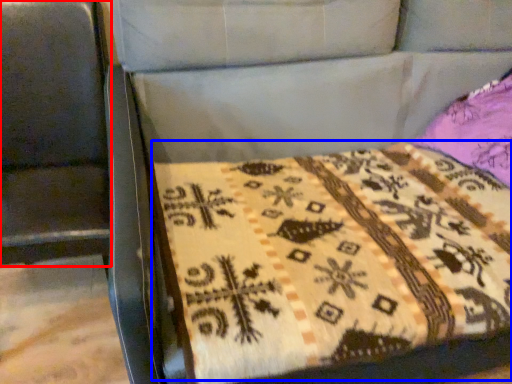
Question: Which point is further to the camera, swivel chair (highlighted by a red box) or quilt (highlighted by a blue box)?

Choices:
 (A) swivel chair
 (B) quilt

Answer: (B)